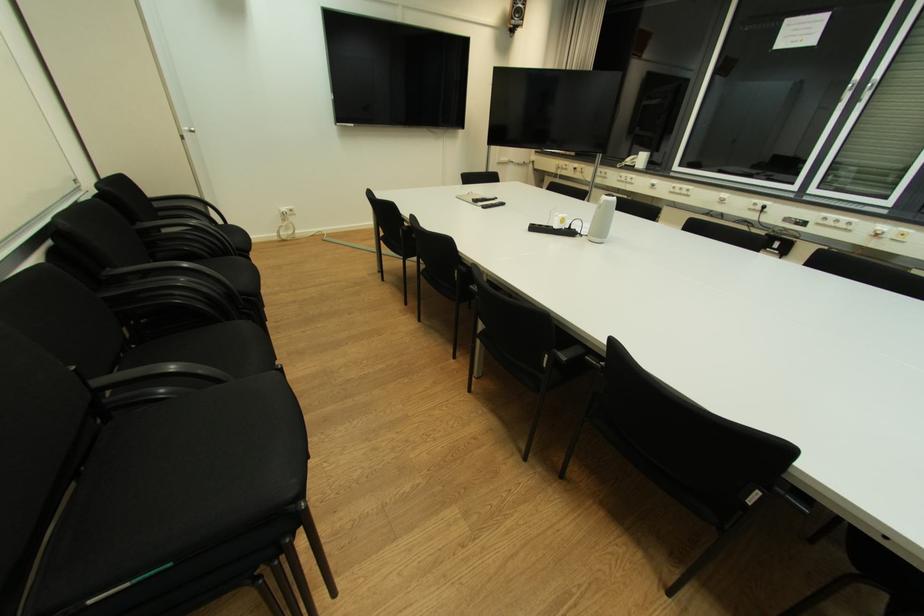
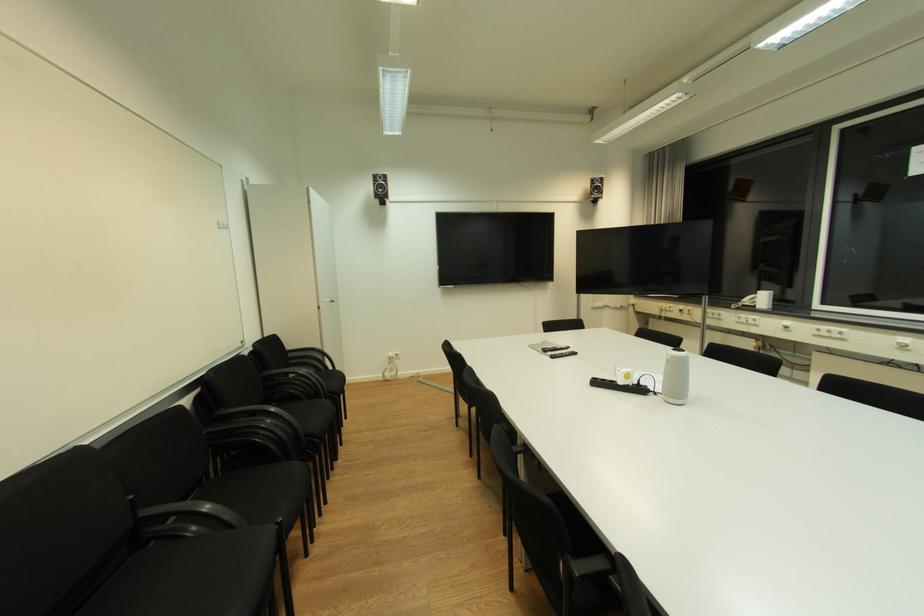
The point at [116,270] is marked in the first image. Where is the corresponding point in the second image?

(227, 410)